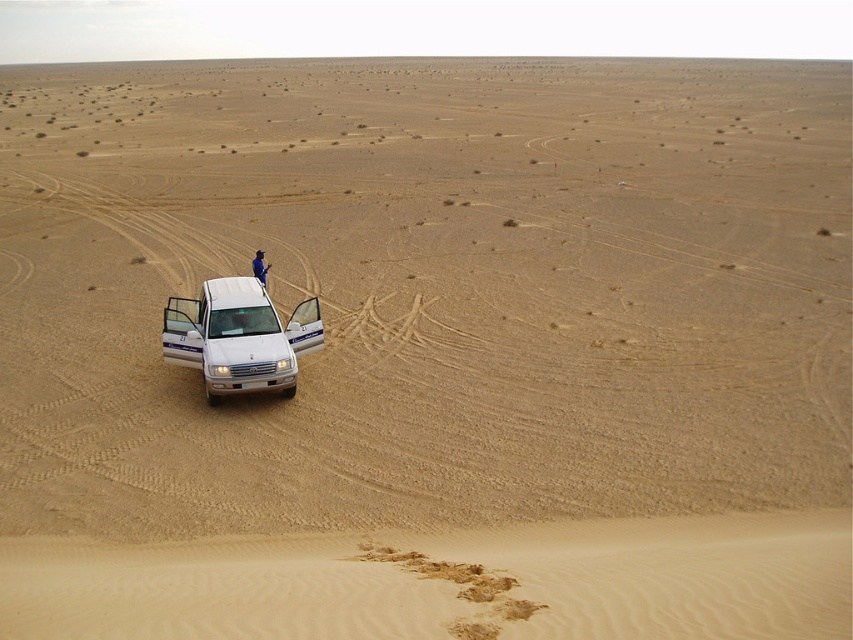
Question: Does white matte jeep at lower left appear over blue fabric person at center?

Choices:
 (A) yes
 (B) no

Answer: (B)

Question: Among these points, which one is farthest from the camera?

Choices:
 (A) [x=253, y=259]
 (B) [x=216, y=356]

Answer: (A)

Question: Does white matte jeep at lower left appear on the left side of blue fabric person at center?

Choices:
 (A) no
 (B) yes

Answer: (A)

Question: Can you confirm if white matte jeep at lower left is bigger than blue fabric person at center?

Choices:
 (A) yes
 (B) no

Answer: (B)